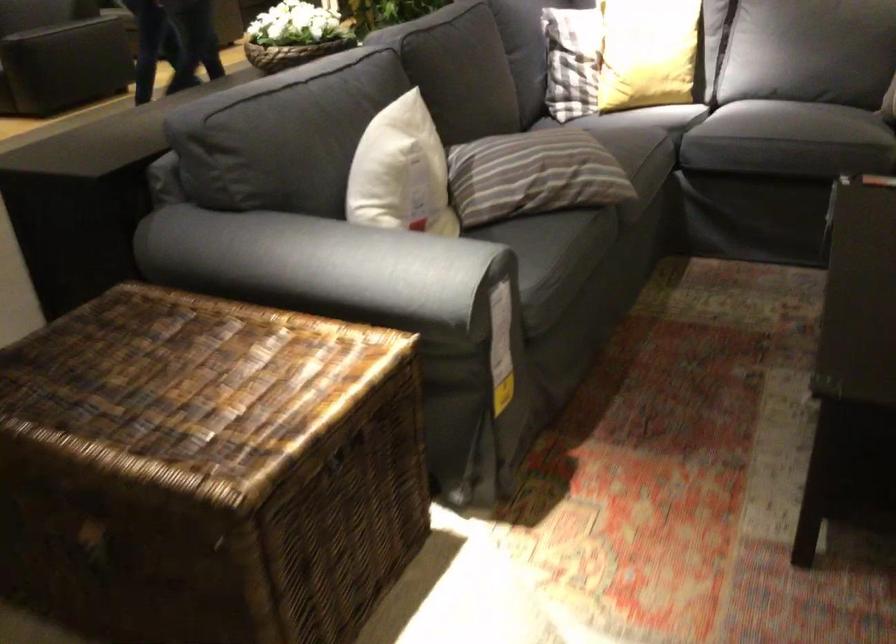
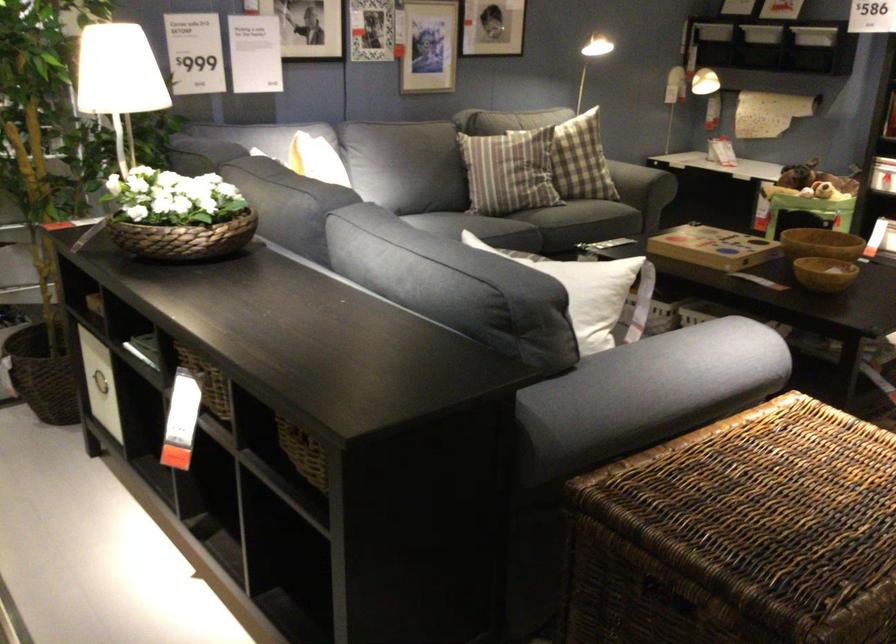
Question: I am providing you with two images of the same scene from different viewpoints. After the viewpoint changes to image2, which objects are now occluded?

Choices:
 (A) black electronics box
 (B) wicker storage basket
 (C) checkered pillow
 (D) striped pillow

Answer: (C)